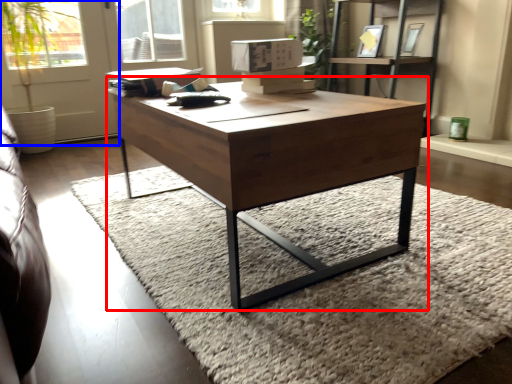
Question: Which point is further to the camera, coffee table (highlighted by a red box) or screen door (highlighted by a blue box)?

Choices:
 (A) coffee table
 (B) screen door

Answer: (B)